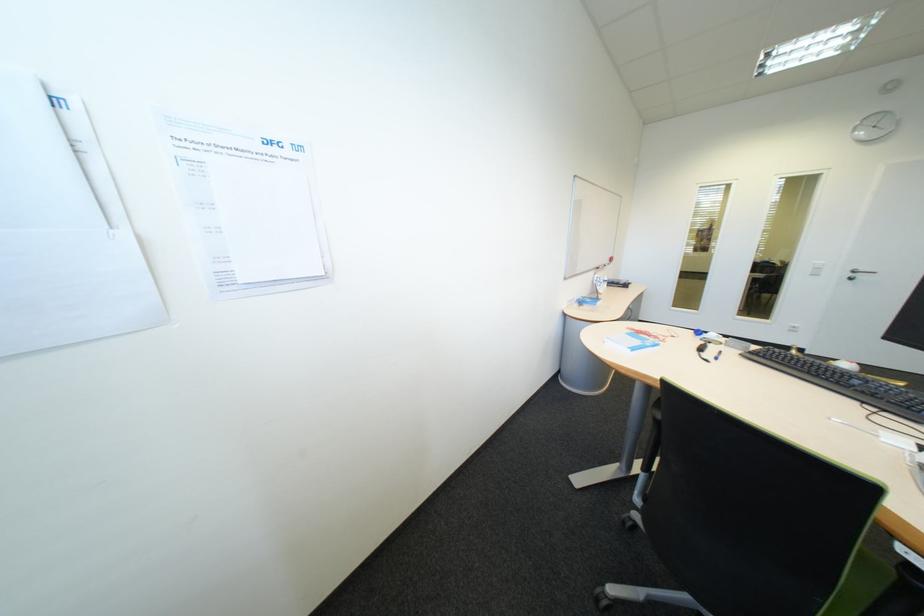
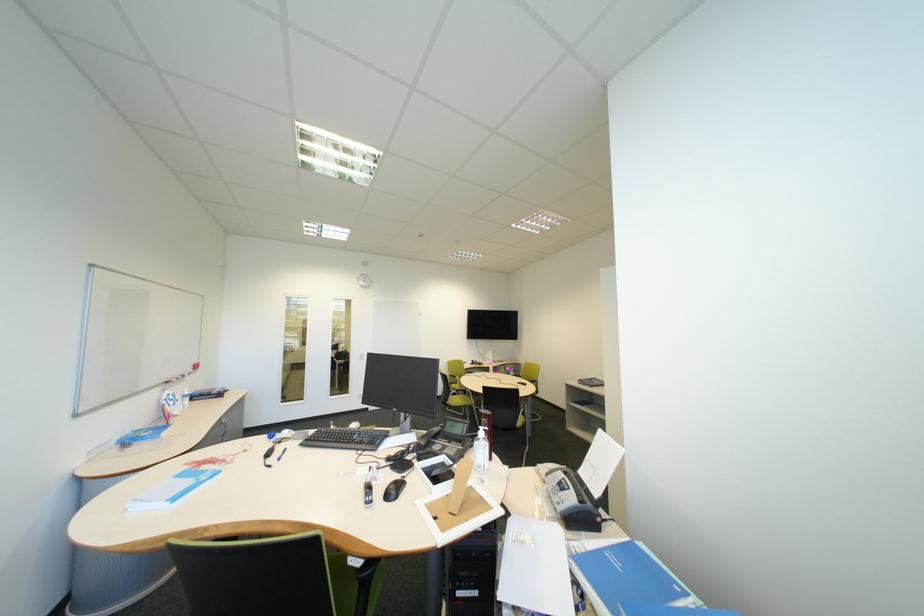
Question: The camera is either moving clockwise (left) or counter-clockwise (right) around the object. The first image is from the beginning of the video and the second image is from the end. Is the camera moving left or right when shooting the video?

Choices:
 (A) Left
 (B) Right

Answer: (A)